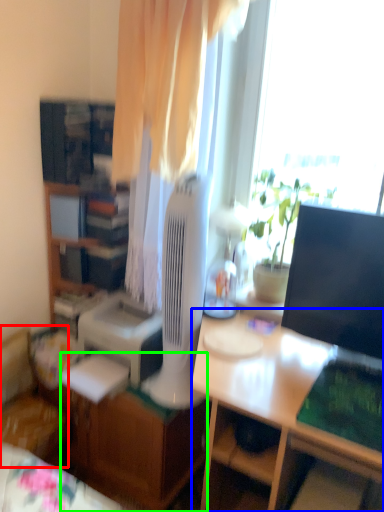
Question: Which object is positioned farthest from chair (highlighted by a red box)? Select from desk (highlighted by a blue box) and desk (highlighted by a green box).

Choices:
 (A) desk
 (B) desk

Answer: (A)